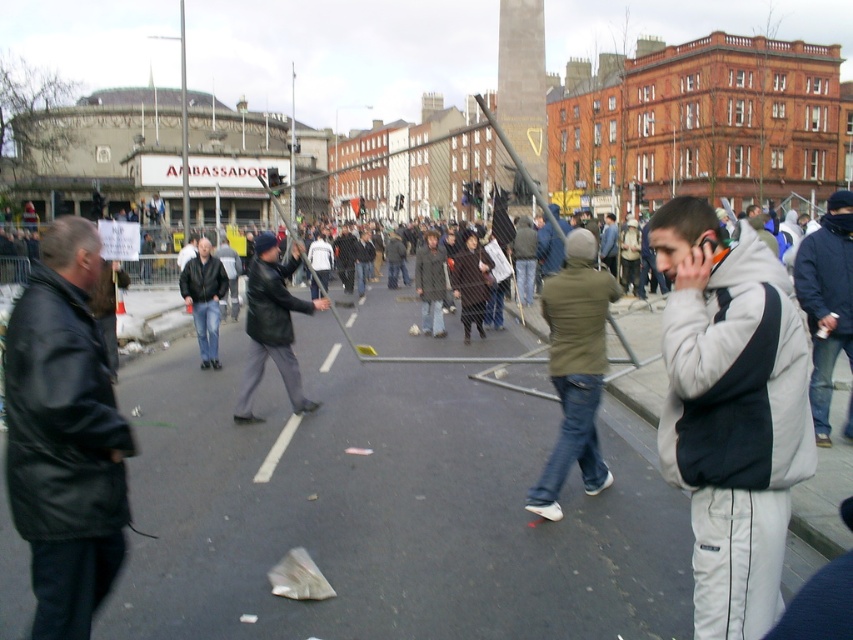
Question: Is gray fleece jacket at center to the left of dark blue jacket at center from the viewer's perspective?

Choices:
 (A) no
 (B) yes

Answer: (B)

Question: Is gray fleece jacket at center to the left of black leather jacket at left from the viewer's perspective?

Choices:
 (A) no
 (B) yes

Answer: (A)

Question: Which object is the closest to the black leather jacket at center?

Choices:
 (A) black leather jacket at left
 (B) dark blue jacket at center
 (C) matte black jacket at center

Answer: (C)

Question: Estimate the real-world distances between objects in this image. Which object is farther from the matte black jacket at center?

Choices:
 (A) gray fleece jacket at center
 (B) black leather jacket at center
 (C) black leather jacket at left

Answer: (A)

Question: Is dark blue jacket at center bigger than matte black jacket at center?

Choices:
 (A) yes
 (B) no

Answer: (A)

Question: Among these objects, which one is farthest from the camera?

Choices:
 (A) black leather jacket at center
 (B) black leather jacket at left

Answer: (A)